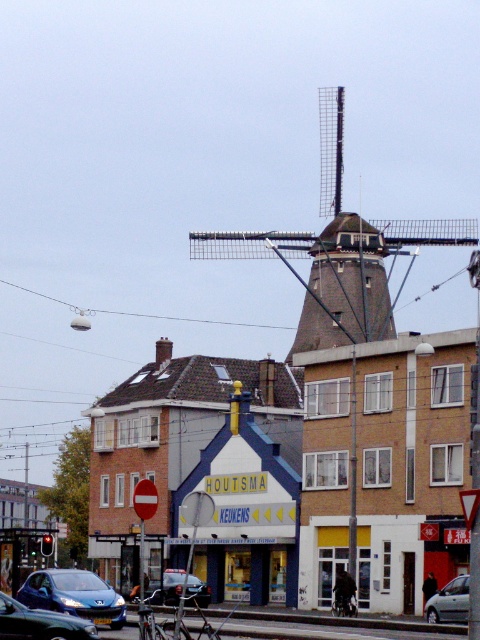
You are a tourist standing on the sidewalk in front of the HOUTSMA KEUKENS shop. You want to take a photo of the brown brick windmill at center but need to ensure it fits in the frame. Considering the silver metallic car at lower right is blocking part of the view, can you estimate if the windmill will be fully visible in your photo?

The brown brick windmill at center is much taller than the silver metallic car at lower right. Since the windmill is significantly taller, parts of it will likely extend above the car, making it possible to capture the entire windmill in the photo despite the obstruction.

You are a delivery person who needs to park your delivery van, which is 2 meters tall, in this street scene. There is a silver metallic car at lower right and a metallic silver car at center. Which parking spot between these two cars can accommodate your van without hitting the roof?

The metallic silver car at center has a greater height than the silver metallic car at lower right. Since your van is 2 meters tall, you should choose the parking spot near the metallic silver car at center because it likely has enough vertical clearance.